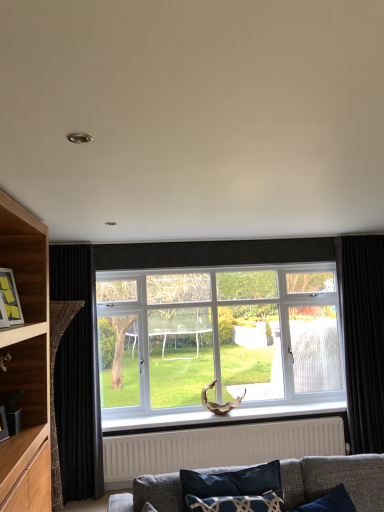
Question: Considering their positions, is white plastic window at center located in front of or behind wooden frame at left?

Choices:
 (A) front
 (B) behind

Answer: (B)

Question: Does point (190, 396) appear closer or farther from the camera than point (6, 303)?

Choices:
 (A) farther
 (B) closer

Answer: (A)

Question: Which is nearer to the black velvet curtain at left, acting as the 1th curtain starting from the left?

Choices:
 (A) white plastic window at center
 (B) black velvet curtain at right, placed as the 1th curtain when sorted from right to left
 (C) wooden frame at left
 (D) velvet dark blue pillow at lower center
 (E) white textured radiator at lower center

Answer: (E)

Question: Which is nearer to the black velvet curtain at right, which ranks as the second curtain in left-to-right order?

Choices:
 (A) velvet dark blue pillow at lower center
 (B) white textured radiator at lower center
 (C) wooden frame at left
 (D) black velvet curtain at left, acting as the 1th curtain starting from the left
 (E) white plastic window at center

Answer: (E)